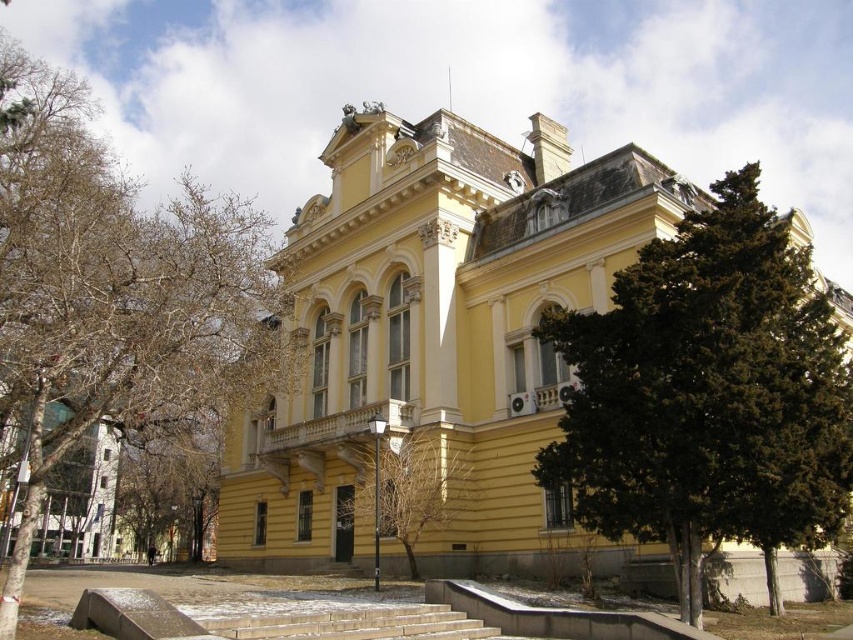
You are standing in front of the grand yellow building and notice a point marked at coordinates (109, 294). What does this point indicate?

The point at (109, 294) indicates bare branches at left.

You are a landscape architect planning to replace the trees in front of the grand yellow building. You need to know which tree occupies more space in the current layout. Which one is bigger between the bare branches at left and the green leafy tree at center?

The bare branches at left is larger in size than the green leafy tree at center, so the bare branches at left occupies more space in the current layout.